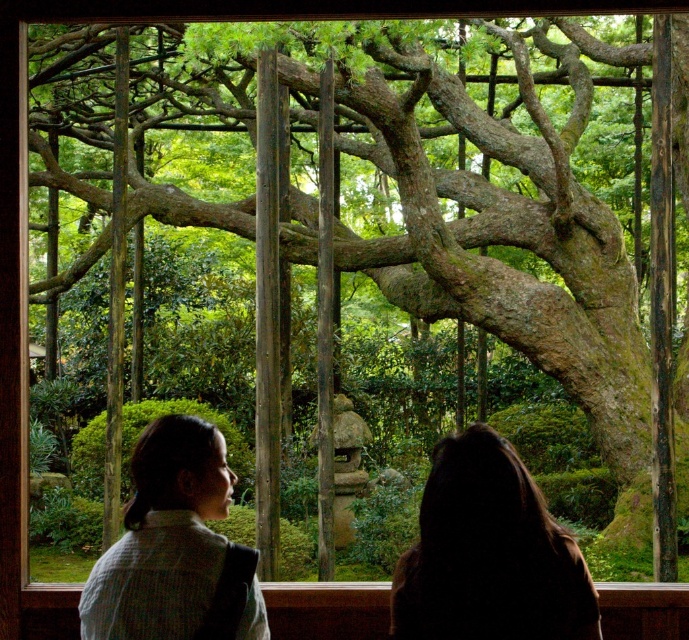
Can you confirm if dark brown hair at upper center is positioned below white textured sweater at lower left?

No.

Who is shorter, dark brown hair at upper center or white textured sweater at lower left?

dark brown hair at upper center

Does point (422, 634) come in front of point (189, 524)?

Yes, point (422, 634) is closer to viewer.

Find the location of `dark brown hair at upper center`. dark brown hair at upper center is located at coordinates (489, 554).